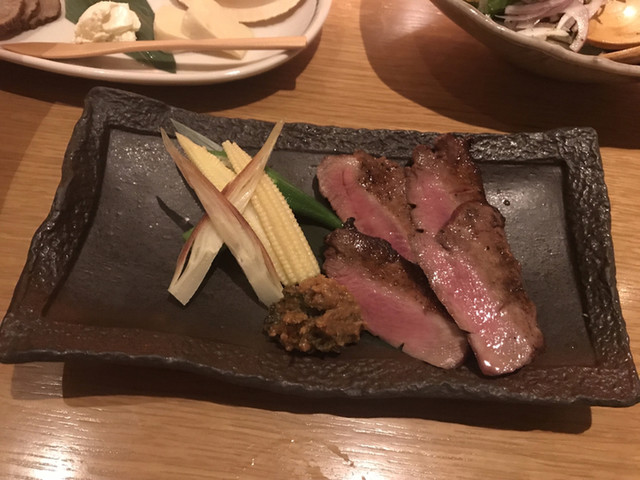
What are the coordinates of `plate` in the screenshot? It's located at (204, 82).